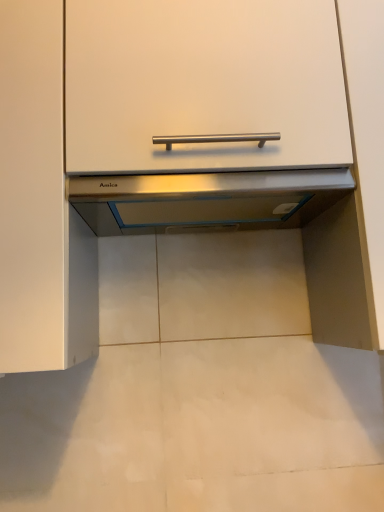
Where is `satin silver cabinet at center`? Image resolution: width=384 pixels, height=512 pixels. satin silver cabinet at center is located at coordinates (182, 144).

What do you see at coordinates (182, 144) in the screenshot? I see `satin silver cabinet at center` at bounding box center [182, 144].

The width and height of the screenshot is (384, 512). In order to click on satin silver exhaust hood at center in this screenshot , I will do `click(206, 199)`.

What do you see at coordinates (206, 199) in the screenshot?
I see `satin silver exhaust hood at center` at bounding box center [206, 199].

Measure the distance between satin silver exhaust hood at center and camera.

28.24 inches.

Find the location of a particular element. Image resolution: width=384 pixels, height=512 pixels. satin silver cabinet at center is located at coordinates (182, 144).

Which is more to the left, satin silver cabinet at center or satin silver exhaust hood at center?

Positioned to the left is satin silver cabinet at center.

In the image, is satin silver cabinet at center positioned in front of or behind satin silver exhaust hood at center?

Visually, satin silver cabinet at center is located in front of satin silver exhaust hood at center.

Is point (86, 259) more distant than point (138, 176)?

Yes, point (86, 259) is farther from viewer.

From the image's perspective, is satin silver cabinet at center above satin silver exhaust hood at center?

Yes, from the image's perspective, satin silver cabinet at center is over satin silver exhaust hood at center.

From a real-world perspective, is satin silver cabinet at center located beneath satin silver exhaust hood at center?

No, from a real-world perspective, satin silver cabinet at center is not below satin silver exhaust hood at center.

Can you confirm if satin silver cabinet at center is thinner than satin silver exhaust hood at center?

No.

Does satin silver cabinet at center have a greater height compared to satin silver exhaust hood at center?

Yes, satin silver cabinet at center is taller than satin silver exhaust hood at center.

Considering the sizes of objects satin silver cabinet at center and satin silver exhaust hood at center in the image provided, who is bigger, satin silver cabinet at center or satin silver exhaust hood at center?

Bigger between the two is satin silver cabinet at center.

Choose the correct answer: Is satin silver cabinet at center inside satin silver exhaust hood at center or outside it?

satin silver cabinet at center exists outside the volume of satin silver exhaust hood at center.

Is satin silver cabinet at center positioned far away from satin silver exhaust hood at center?

They are positioned close to each other.

Is satin silver cabinet at center facing towards satin silver exhaust hood at center?

Yes, satin silver cabinet at center faces towards satin silver exhaust hood at center.

The height and width of the screenshot is (512, 384). In order to click on exhaust hood below the satin silver cabinet at center (from the image's perspective) in this screenshot , I will do `click(206, 199)`.

Considering the relative positions of satin silver exhaust hood at center and satin silver cabinet at center in the image provided, is satin silver exhaust hood at center to the left or to the right of satin silver cabinet at center?

Based on their positions, satin silver exhaust hood at center is located to the right of satin silver cabinet at center.

Considering the positions of objects satin silver exhaust hood at center and satin silver cabinet at center in the image provided, who is behind, satin silver exhaust hood at center or satin silver cabinet at center?

Positioned behind is satin silver exhaust hood at center.

Is point (236, 182) closer or farther from the camera than point (181, 174)?

Point (236, 182).

From the image's perspective, between satin silver exhaust hood at center and satin silver cabinet at center, which one is located above?

From the image's view, satin silver cabinet at center is above.

From a real-world perspective, does satin silver exhaust hood at center sit lower than satin silver cabinet at center?

Yes, from a real-world perspective, satin silver exhaust hood at center is below satin silver cabinet at center.

Between satin silver exhaust hood at center and satin silver cabinet at center, which one has larger width?

With larger width is satin silver cabinet at center.

Is satin silver exhaust hood at center taller or shorter than satin silver cabinet at center?

Considering their sizes, satin silver exhaust hood at center has less height than satin silver cabinet at center.

Considering the relative sizes of satin silver exhaust hood at center and satin silver cabinet at center in the image provided, is satin silver exhaust hood at center bigger than satin silver cabinet at center?

No.

Is satin silver cabinet at center located within satin silver exhaust hood at center?

No, satin silver cabinet at center is not surrounded by satin silver exhaust hood at center.

Would you consider satin silver exhaust hood at center to be distant from satin silver cabinet at center?

No.

Could you tell me if satin silver exhaust hood at center is turned towards satin silver cabinet at center?

Yes, satin silver exhaust hood at center is oriented towards satin silver cabinet at center.

There is a satin silver exhaust hood at center. Identify the location of cabinetry above it (from a real-world perspective). (182, 144).

This screenshot has width=384, height=512. Find the location of `exhaust hood that appears behind the satin silver cabinet at center`. exhaust hood that appears behind the satin silver cabinet at center is located at coordinates (206, 199).

Find the location of `exhaust hood below the satin silver cabinet at center (from a real-world perspective)`. exhaust hood below the satin silver cabinet at center (from a real-world perspective) is located at coordinates (206, 199).